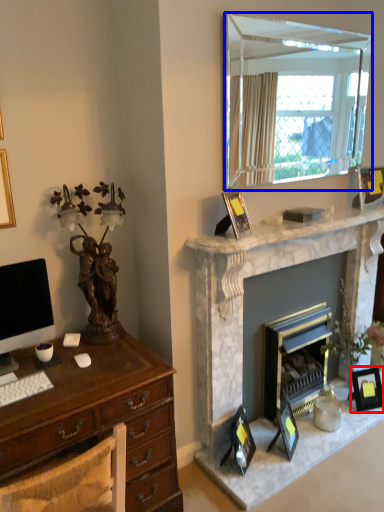
Question: Among these objects, which one is nearest to the camera, picture frame (highlighted by a red box) or mirror (highlighted by a blue box)?

Choices:
 (A) picture frame
 (B) mirror

Answer: (B)